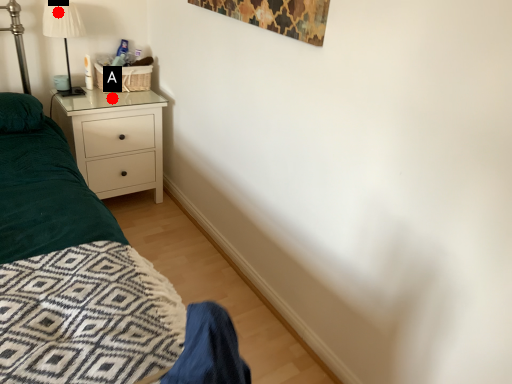
Question: Two points are circled on the image, labeled by A and B beside each circle. Which point is further to the camera?

Choices:
 (A) A is further
 (B) B is further

Answer: (A)